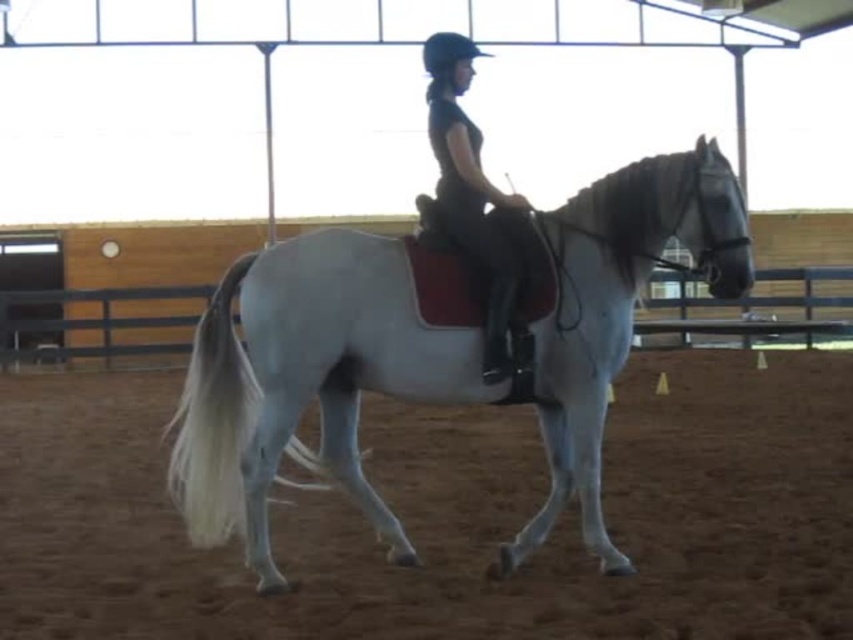
Who is taller, brown dirt track at center or white glossy horse at center?

Standing taller between the two is white glossy horse at center.

Does brown dirt track at center appear on the right side of white glossy horse at center?

Correct, you'll find brown dirt track at center to the right of white glossy horse at center.

Image resolution: width=853 pixels, height=640 pixels. In order to click on brown dirt track at center in this screenshot , I will do tap(450, 515).

This screenshot has height=640, width=853. Identify the location of brown dirt track at center. (450, 515).

Which of these two, white glossy horse at center or black leather pants at center, stands shorter?

Standing shorter between the two is black leather pants at center.

Based on the photo, can you confirm if white glossy horse at center is taller than black leather pants at center?

Indeed, white glossy horse at center has a greater height compared to black leather pants at center.

Is point (581, 486) closer to camera compared to point (480, 241)?

Yes.

Locate an element on the screen. white glossy horse at center is located at coordinates (305, 381).

Which is behind, point (788, 444) or point (503, 246)?

Point (788, 444)

Can you confirm if brown dirt track at center is positioned below black leather pants at center?

Indeed, brown dirt track at center is positioned under black leather pants at center.

Image resolution: width=853 pixels, height=640 pixels. Identify the location of brown dirt track at center. (450, 515).

This screenshot has height=640, width=853. Identify the location of brown dirt track at center. (450, 515).